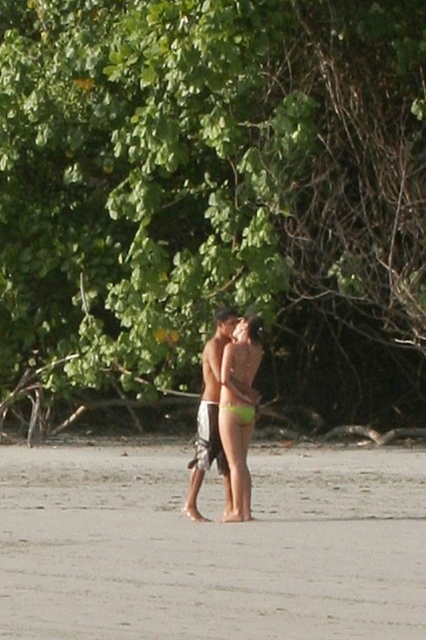
You are standing on the beach and want to take a photo of the gray sand at center and the green leafy tree at upper center. Which object should you focus on first to ensure both are in the frame?

You should focus on the green leafy tree at upper center first because the gray sand at center is behind it, ensuring both are visible in the frame.

You are standing on the beach and want to take a photo of the green leafy tree at upper center. Where should you position yourself to capture it in the frame?

Position yourself facing the green leafy tree at upper center located at coordinates approximately 0.306 on the horizontal axis and 0.507 on the vertical axis to capture it in the frame.

You are a photographer trying to capture the green fabric bikini at center without the green leafy tree at upper center blocking the view. What adjustment should you make to your camera angle?

The green leafy tree at upper center is above the green fabric bikini at center, so you should lower your camera angle to avoid the tree blocking the view.